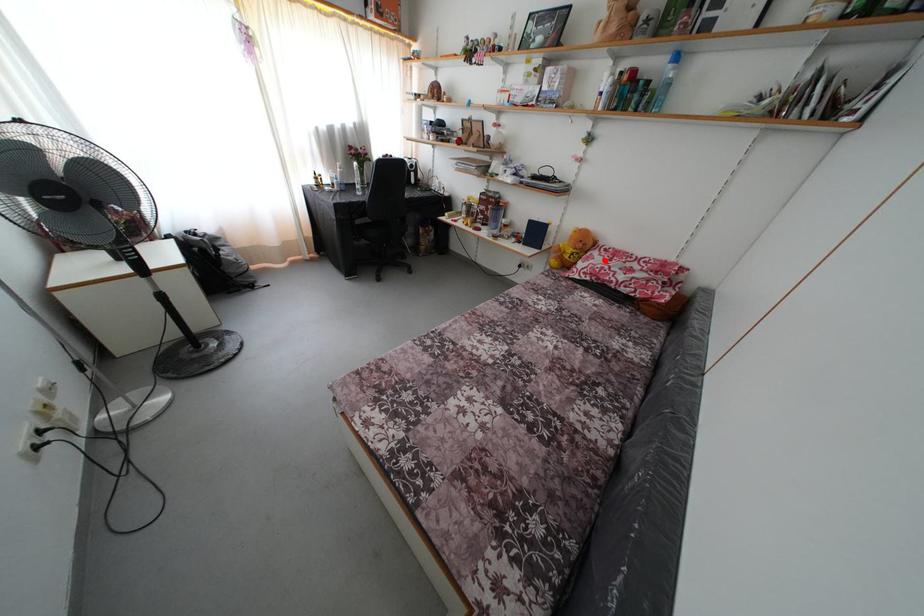
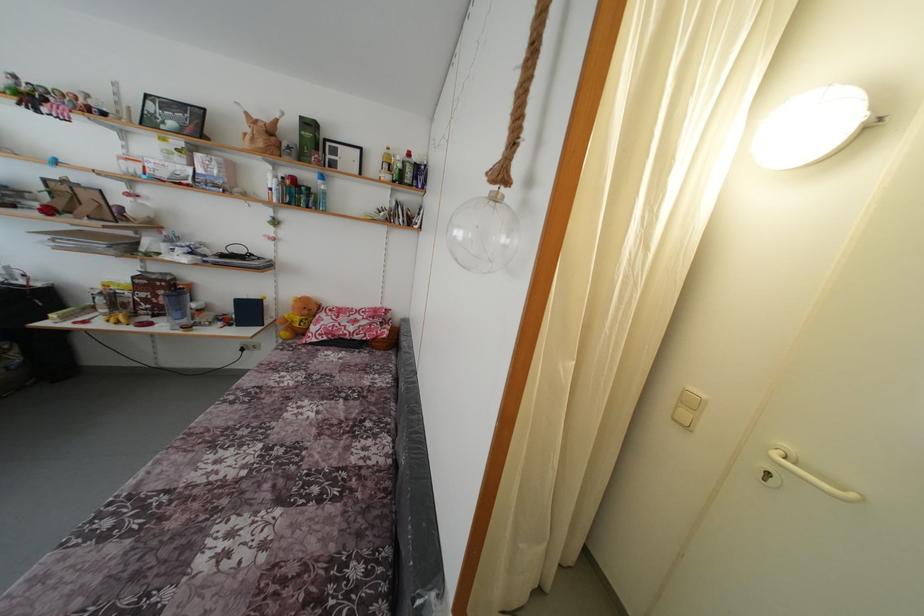
Question: I am providing you with two images of the same scene from different viewpoints. A red point is shown in image1. For the corresponding object point in image2, is it positioned nearer or farther from the camera?

Choices:
 (A) Nearer
 (B) Farther

Answer: (B)